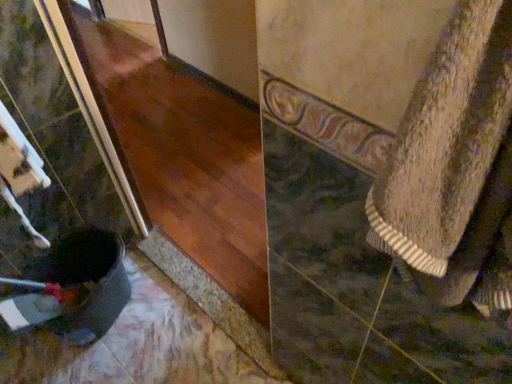
Question: Is textured beige towel at right looking in the opposite direction of glossy wood at lower left?

Choices:
 (A) no
 (B) yes

Answer: (A)

Question: Can you confirm if textured beige towel at right is taller than glossy wood at lower left?

Choices:
 (A) yes
 (B) no

Answer: (B)

Question: Is textured beige towel at right placed right next to glossy wood at lower left?

Choices:
 (A) yes
 (B) no

Answer: (B)

Question: Is textured beige towel at right to the left of glossy wood at lower left from the viewer's perspective?

Choices:
 (A) yes
 (B) no

Answer: (B)

Question: Can we say textured beige towel at right lies outside glossy wood at lower left?

Choices:
 (A) no
 (B) yes

Answer: (B)

Question: From a real-world perspective, is textured beige towel at right positioned under glossy wood at lower left based on gravity?

Choices:
 (A) no
 (B) yes

Answer: (A)

Question: From the image's perspective, is glossy wood at lower left over textured beige towel at right?

Choices:
 (A) no
 (B) yes

Answer: (B)

Question: Is glossy wood at lower left wider than textured beige towel at right?

Choices:
 (A) no
 (B) yes

Answer: (A)

Question: Considering the relative sizes of glossy wood at lower left and textured beige towel at right in the image provided, is glossy wood at lower left taller than textured beige towel at right?

Choices:
 (A) yes
 (B) no

Answer: (A)

Question: Does glossy wood at lower left have a smaller size compared to textured beige towel at right?

Choices:
 (A) yes
 (B) no

Answer: (B)

Question: Could you tell me if glossy wood at lower left is turned towards textured beige towel at right?

Choices:
 (A) yes
 (B) no

Answer: (B)

Question: Is glossy wood at lower left behind textured beige towel at right?

Choices:
 (A) yes
 (B) no

Answer: (A)

Question: From their relative heights in the image, would you say glossy wood at lower left is taller or shorter than textured beige towel at right?

Choices:
 (A) short
 (B) tall

Answer: (B)